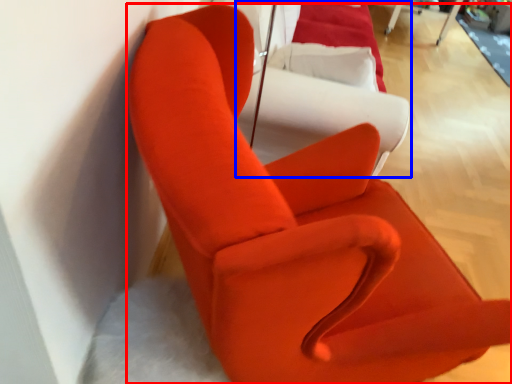
Question: Among these objects, which one is farthest to the camera, chair (highlighted by a red box) or couch (highlighted by a blue box)?

Choices:
 (A) chair
 (B) couch

Answer: (B)